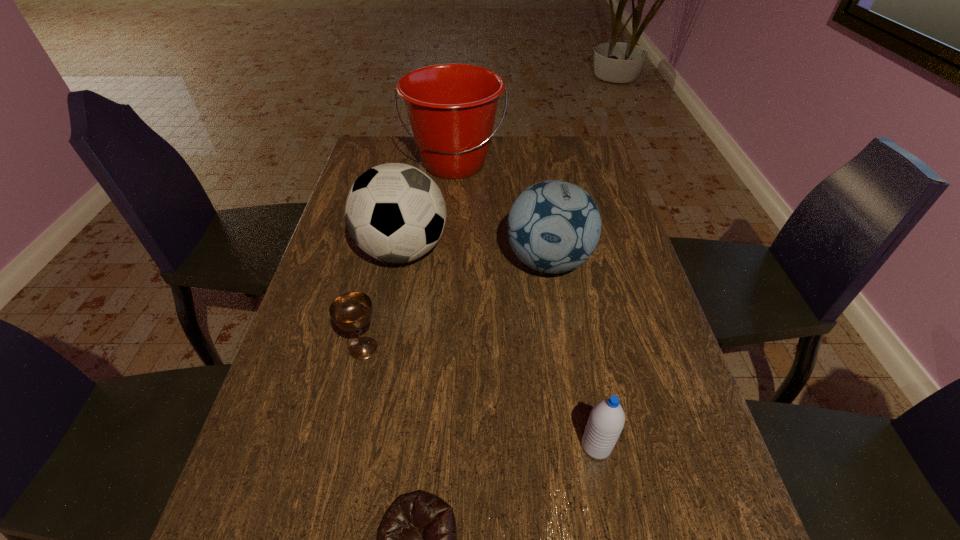
The width and height of the screenshot is (960, 540). Identify the location of vacant space at the right edge of the desktop. (603, 222).

Where is `empty location between the right soccer ball and the third shortest object`? The image size is (960, 540). empty location between the right soccer ball and the third shortest object is located at coordinates (572, 354).

Where is `blank region between the left soccer ball and the fourth farthest object`? blank region between the left soccer ball and the fourth farthest object is located at coordinates (383, 300).

Identify the location of unoccupied position between the third shortest object and the left soccer ball. Image resolution: width=960 pixels, height=540 pixels. (499, 348).

Locate an element on the screen. The width and height of the screenshot is (960, 540). free area in between the fifth tallest object and the fifth farthest object is located at coordinates point(480,397).

Locate an element on the screen. blank region between the left soccer ball and the chalice is located at coordinates (383, 300).

Where is `empty location between the water bottle and the chalice`? empty location between the water bottle and the chalice is located at coordinates click(480, 397).

At what (x,y) coordinates should I click in order to perform the action: click on object identified as the second closest to the left soccer ball. Please return your answer as a coordinate pair (x, y). The height and width of the screenshot is (540, 960). Looking at the image, I should click on (351, 311).

Identify which object is the nearest to the shortest object. Please provide its 2D coordinates. Your answer should be formatted as a tuple, i.e. [(x, y)], where the tuple contains the x and y coordinates of a point satisfying the conditions above.

[(606, 421)]

Identify the location of vacant space that satisfies the following two spatial constraints: 1. with the handle attached to the rim of the bucket; 2. on the main logo of the left soccer ball. This screenshot has width=960, height=540. (447, 251).